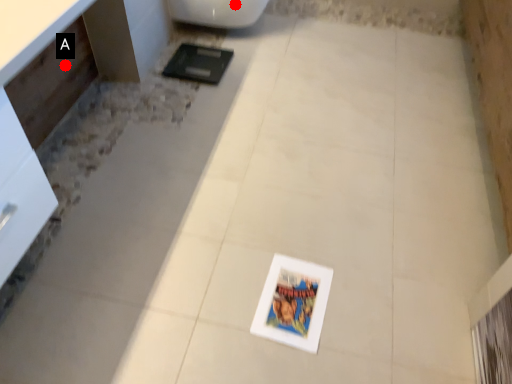
Question: Two points are circled on the image, labeled by A and B beside each circle. Which point is closer to the camera taking this photo?

Choices:
 (A) A is closer
 (B) B is closer

Answer: (A)